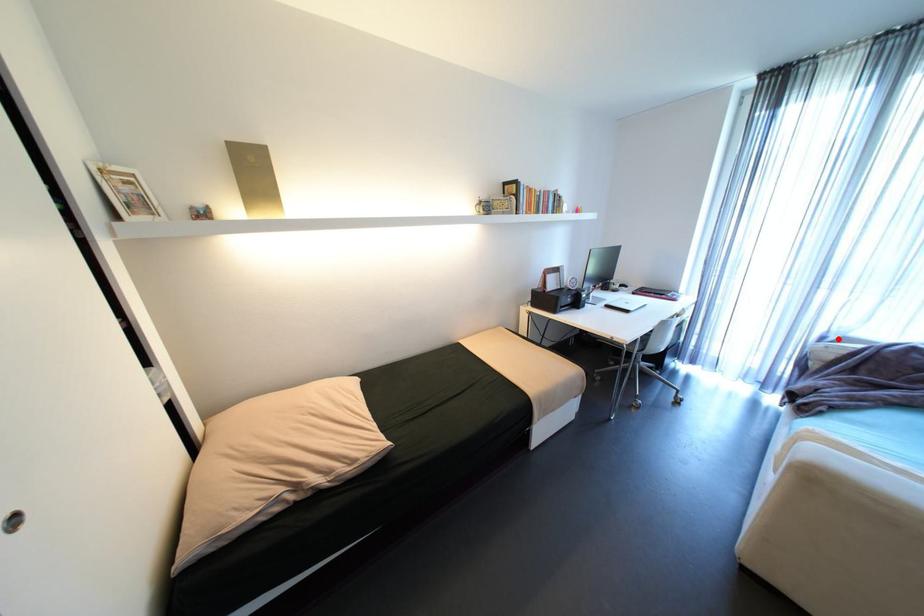
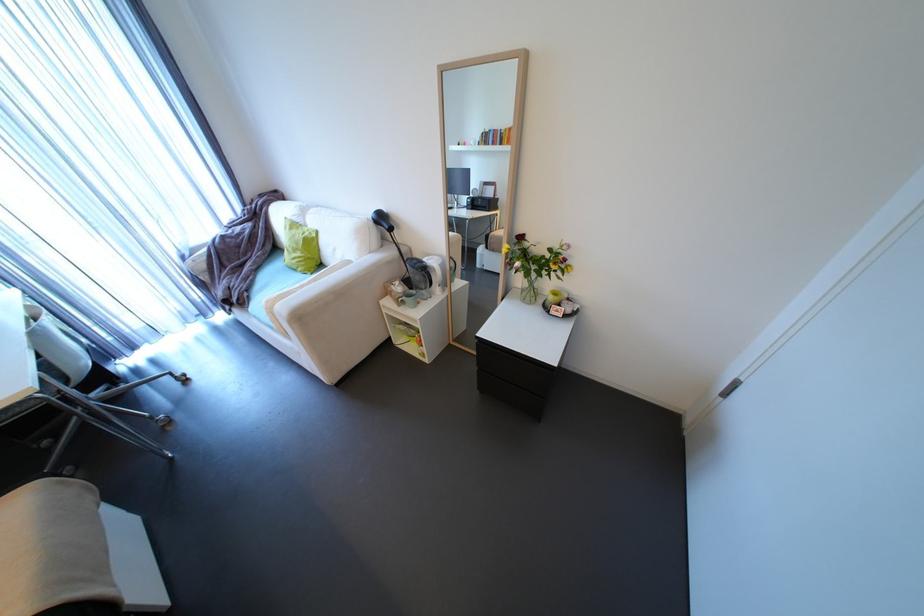
In the second image, find the point that corresponds to the highlighted location in the first image.

(195, 254)